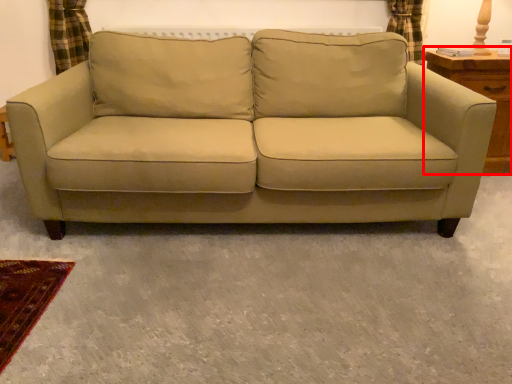
Question: From the image's perspective, what is the correct spatial positioning of dresser (annotated by the red box) in reference to studio couch?

Choices:
 (A) below
 (B) above

Answer: (B)